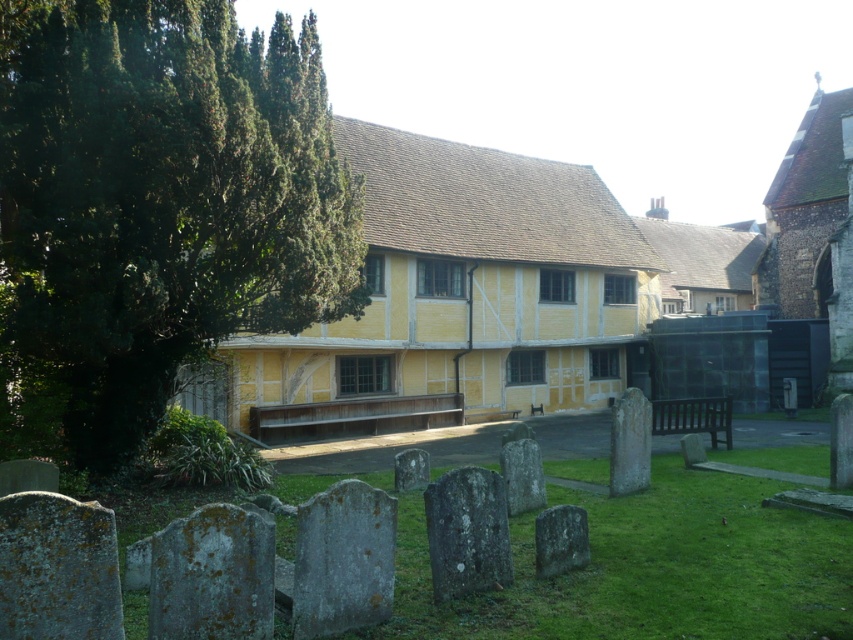
Can you confirm if yellow timber-framed building at center is wider than smooth gray stone at lower center?

Yes.

Between point (410, 241) and point (584, 557), which one is positioned behind?

The point (410, 241) is behind.

The image size is (853, 640). In order to click on yellow timber-framed building at center in this screenshot , I will do `click(459, 298)`.

Can you confirm if green leafy tree at left is positioned to the left of yellow timber-framed building at center?

Indeed, green leafy tree at left is positioned on the left side of yellow timber-framed building at center.

Which of these two, green leafy tree at left or yellow timber-framed building at center, stands taller?

yellow timber-framed building at center is taller.

Locate an element on the screen. green leafy tree at left is located at coordinates (160, 202).

You are a GUI agent. You are given a task and a screenshot of the screen. Output one action in this format:
    pyautogui.click(x=<x>, y=<y>)
    Task: Click on the green leafy tree at left
    This screenshot has width=853, height=640.
    Given the screenshot: What is the action you would take?
    pyautogui.click(x=160, y=202)

Between yellow timber-framed building at center and gray stone gravestone at center, which one has less height?

gray stone gravestone at center is shorter.

Is point (553, 307) positioned before point (431, 499)?

No.

Where is `yellow timber-framed building at center`? Image resolution: width=853 pixels, height=640 pixels. yellow timber-framed building at center is located at coordinates (459, 298).